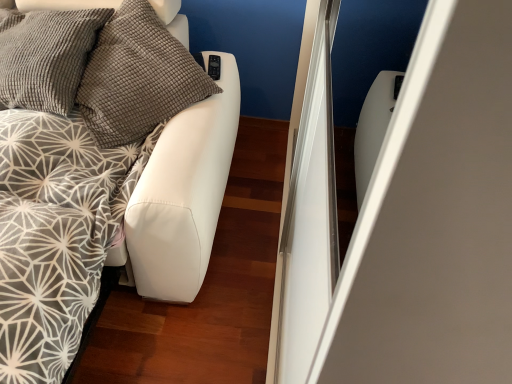
Question: Is textured gray pillow at upper left beside white leather bed at left?

Choices:
 (A) yes
 (B) no

Answer: (B)

Question: Can you confirm if textured gray pillow at upper left is bigger than white leather bed at left?

Choices:
 (A) no
 (B) yes

Answer: (A)

Question: From a real-world perspective, is textured gray pillow at upper left on top of white leather bed at left?

Choices:
 (A) no
 (B) yes

Answer: (B)

Question: Could you tell me if textured gray pillow at upper left is facing white leather bed at left?

Choices:
 (A) no
 (B) yes

Answer: (B)

Question: Considering the relative positions of textured gray pillow at upper left and white leather bed at left in the image provided, is textured gray pillow at upper left to the right of white leather bed at left from the viewer's perspective?

Choices:
 (A) no
 (B) yes

Answer: (B)

Question: Is textured gray pillow at upper left turned away from white leather bed at left?

Choices:
 (A) yes
 (B) no

Answer: (A)

Question: Does white leather bed at left have a smaller size compared to textured gray pillow at upper left?

Choices:
 (A) yes
 (B) no

Answer: (B)

Question: Is white leather bed at left thinner than textured gray pillow at upper left?

Choices:
 (A) yes
 (B) no

Answer: (B)

Question: Could you tell me if white leather bed at left is facing textured gray pillow at upper left?

Choices:
 (A) yes
 (B) no

Answer: (B)

Question: From a real-world perspective, is white leather bed at left under textured gray pillow at upper left?

Choices:
 (A) yes
 (B) no

Answer: (A)

Question: From the image's perspective, does white leather bed at left appear lower than textured gray pillow at upper left?

Choices:
 (A) yes
 (B) no

Answer: (A)

Question: Is white leather bed at left far away from textured gray pillow at upper left?

Choices:
 (A) yes
 (B) no

Answer: (B)

Question: Is point (1, 283) closer or farther from the camera than point (108, 129)?

Choices:
 (A) farther
 (B) closer

Answer: (B)